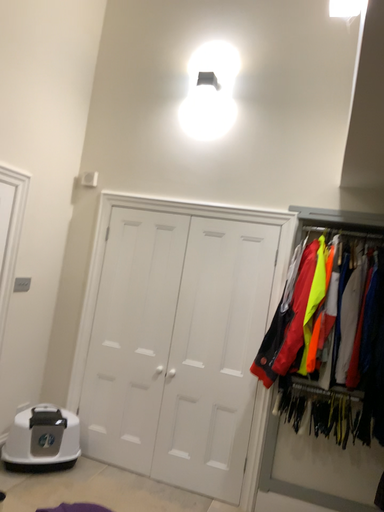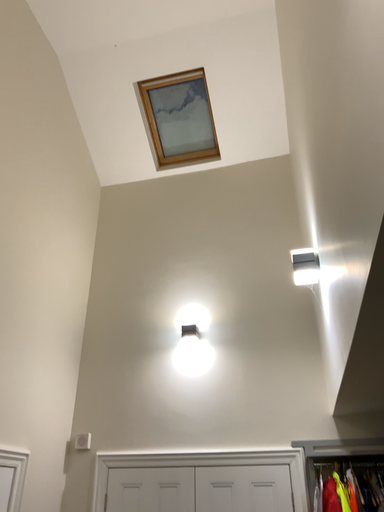
Question: How did the camera likely rotate when shooting the video?

Choices:
 (A) rotated downward
 (B) rotated upward

Answer: (B)